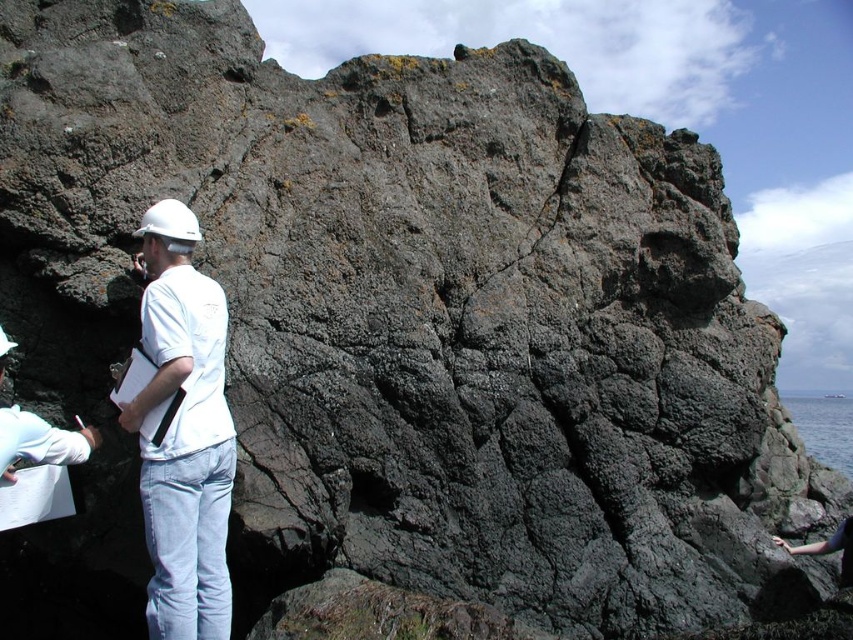
You are a safety inspector on the rocky coastal scene. You notice two protective headgear items at the left side of the image. Which one has a wider base? The options are the white matte helmet at left and the white matte hard hat at left.

The white matte helmet at left is wider than the white matte hard hat at left according to the description.

You are a hiker who has just arrived at this coastal area. You notice the white matte helmet at left and the blue liquid water at lower right. Which object is positioned to the left of the other?

The white matte helmet at left is to the left of blue liquid water at lower right.